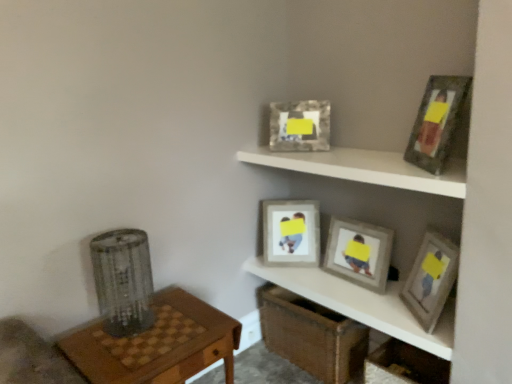
Question: Is white matte shelf at upper center, which is counted as the 2th shelf, starting from the bottom, next to wooden picture frame at upper right, arranged as the 1th picture frame when viewed from the front?

Choices:
 (A) yes
 (B) no

Answer: (B)

Question: Is white matte shelf at upper center, placed as the 1th shelf when sorted from top to bottom, positioned behind wooden picture frame at upper right, arranged as the 1th picture frame when viewed from the front?

Choices:
 (A) no
 (B) yes

Answer: (A)

Question: Does white matte shelf at upper center, placed as the 1th shelf when sorted from top to bottom, have a greater height compared to wooden picture frame at upper right, arranged as the 1th picture frame when viewed from the front?

Choices:
 (A) yes
 (B) no

Answer: (B)

Question: Considering the relative sizes of white matte shelf at upper center, which is counted as the 2th shelf, starting from the bottom, and wooden picture frame at upper right, arranged as the 1th picture frame when viewed from the front, in the image provided, is white matte shelf at upper center, which is counted as the 2th shelf, starting from the bottom, smaller than wooden picture frame at upper right, arranged as the 1th picture frame when viewed from the front,?

Choices:
 (A) yes
 (B) no

Answer: (B)

Question: Does white matte shelf at upper center, which is counted as the 2th shelf, starting from the bottom, have a greater width compared to wooden picture frame at upper right, arranged as the 1th picture frame when viewed from the front?

Choices:
 (A) yes
 (B) no

Answer: (A)

Question: Is wooden at left taller or shorter than matte gray picture frame at center, which is the 3th picture frame in back-to-front order?

Choices:
 (A) short
 (B) tall

Answer: (B)

Question: Considering the positions of point (214, 307) and point (330, 228), is point (214, 307) closer or farther from the camera than point (330, 228)?

Choices:
 (A) closer
 (B) farther

Answer: (A)

Question: Looking at their shapes, would you say wooden at left is wider or thinner than matte gray picture frame at center, which is the 3th picture frame in back-to-front order?

Choices:
 (A) wide
 (B) thin

Answer: (A)

Question: Considering the relative positions of wooden at left and matte gray picture frame at center, which is the 3th picture frame in back-to-front order, in the image provided, is wooden at left to the left or to the right of matte gray picture frame at center, which is the 3th picture frame in back-to-front order,?

Choices:
 (A) left
 (B) right

Answer: (A)

Question: Is white matte shelf at upper center, placed as the 1th shelf when sorted from top to bottom, bigger or smaller than wooden at left?

Choices:
 (A) big
 (B) small

Answer: (B)

Question: Is point (251, 162) closer or farther from the camera than point (227, 342)?

Choices:
 (A) closer
 (B) farther

Answer: (B)

Question: Looking at their shapes, would you say white matte shelf at upper center, which is counted as the 2th shelf, starting from the bottom, is wider or thinner than wooden at left?

Choices:
 (A) thin
 (B) wide

Answer: (A)

Question: Would you say white matte shelf at upper center, placed as the 1th shelf when sorted from top to bottom, is to the left or to the right of wooden at left in the picture?

Choices:
 (A) left
 (B) right

Answer: (B)

Question: Looking at their shapes, would you say wooden picture frames at center, acting as the 2th shelf starting from the top, is wider or thinner than white matte shelf at upper center, which is counted as the 2th shelf, starting from the bottom?

Choices:
 (A) wide
 (B) thin

Answer: (B)

Question: Would you say wooden picture frames at center, positioned as the 1th shelf in bottom-to-top order, is inside or outside white matte shelf at upper center, placed as the 1th shelf when sorted from top to bottom?

Choices:
 (A) outside
 (B) inside

Answer: (A)